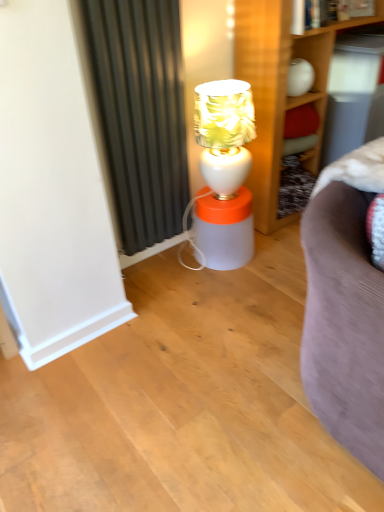
The height and width of the screenshot is (512, 384). Describe the element at coordinates (224, 173) in the screenshot. I see `white glossy lamp at center` at that location.

Find the location of a particular element. The image size is (384, 512). white glossy lamp at center is located at coordinates (224, 173).

At what (x,y) coordinates should I click in order to perform the action: click on white glossy lamp at center. Please return your answer as a coordinate pair (x, y). Looking at the image, I should click on (224, 173).